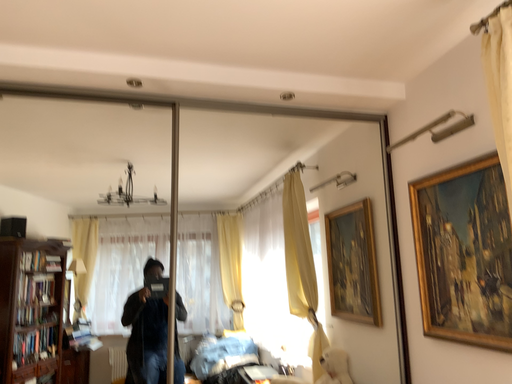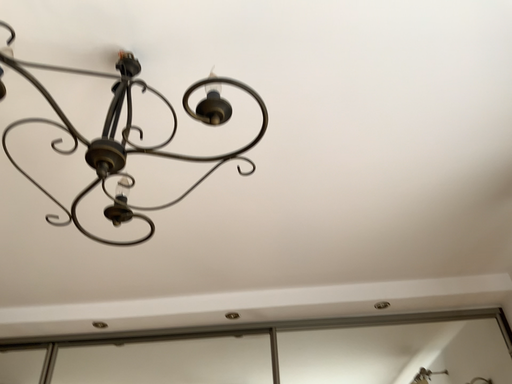
Question: How did the camera likely rotate when shooting the video?

Choices:
 (A) rotated left
 (B) rotated right

Answer: (A)